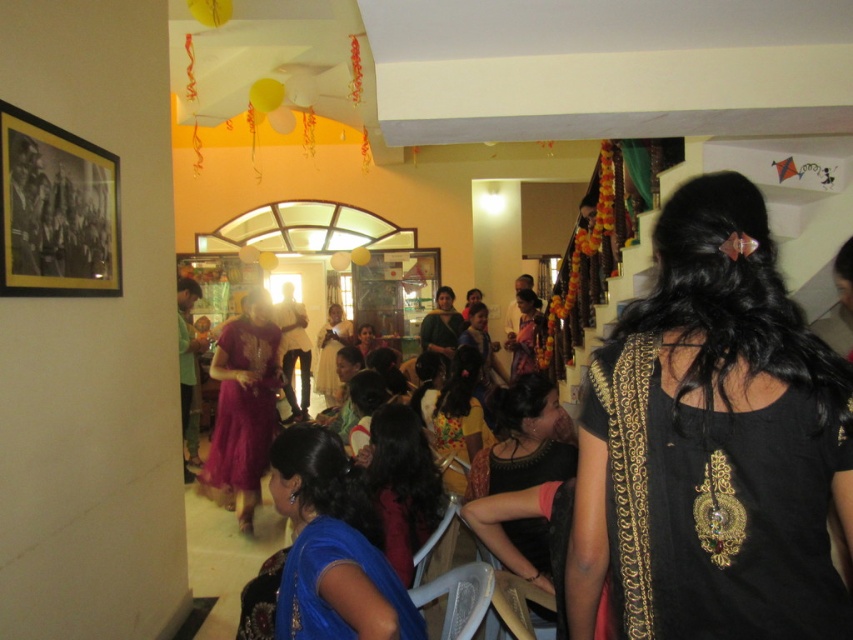
Question: Which point appears farthest from the camera in this image?

Choices:
 (A) (259, 324)
 (B) (326, 320)
 (C) (341, 488)
 (D) (425, 436)

Answer: (B)

Question: Where is blue satin saree at center located in relation to matte pink saree at center in the image?

Choices:
 (A) right
 (B) left

Answer: (A)

Question: Is black embroidered blouse at center positioned in front of matte pink saree at center?

Choices:
 (A) no
 (B) yes

Answer: (B)

Question: Can you confirm if black embroidered blouse at center is positioned to the right of matte black dress at center?

Choices:
 (A) no
 (B) yes

Answer: (B)

Question: Considering the real-world distances, which object is farthest from the shiny magenta dress at center?

Choices:
 (A) matte black dress at center
 (B) black satin blouse at center
 (C) matte pink saree at center

Answer: (C)

Question: Which object is farther from the camera taking this photo?

Choices:
 (A) shiny magenta dress at center
 (B) blue satin saree at center
 (C) black satin blouse at center
 (D) black embroidered blouse at center

Answer: (A)